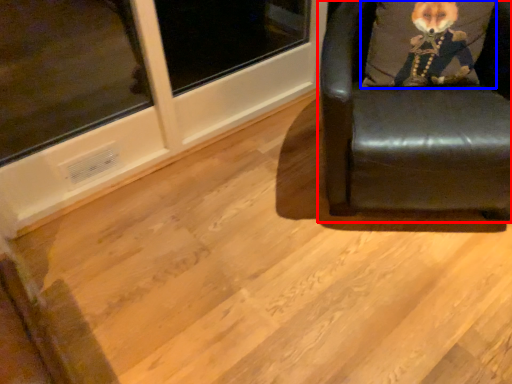
Question: Which object appears closest to the camera in this image, chair (highlighted by a red box) or throw pillow (highlighted by a blue box)?

Choices:
 (A) chair
 (B) throw pillow

Answer: (A)